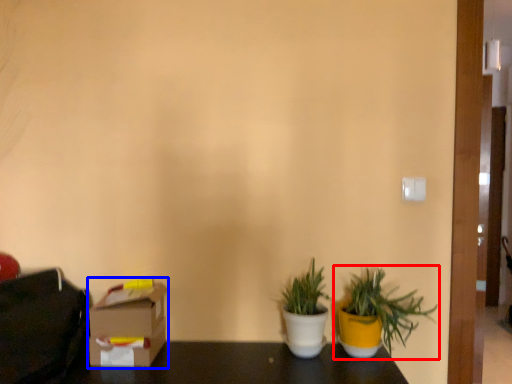
Question: Which point is further to the camera, houseplant (highlighted by a red box) or cardboard box (highlighted by a blue box)?

Choices:
 (A) houseplant
 (B) cardboard box

Answer: (B)